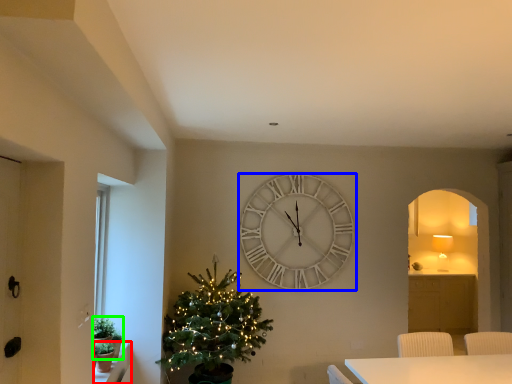
Question: Which object is positioned closest to window sill (highlighted by a red box)? Select from wall clock (highlighted by a blue box) and plant (highlighted by a green box).

Choices:
 (A) wall clock
 (B) plant

Answer: (B)